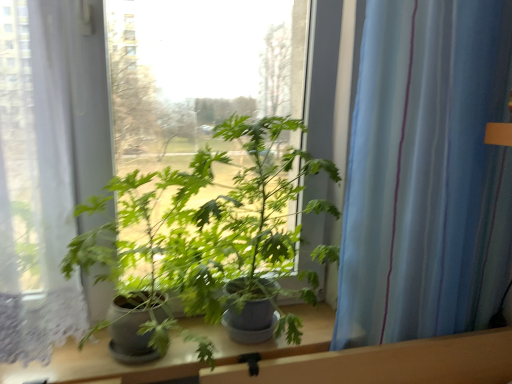
Where is `blue striped curtain at right`? This screenshot has width=512, height=384. blue striped curtain at right is located at coordinates (426, 173).

What is the approximate height of blue striped curtain at right?

It is 37.16 inches.

What do you see at coordinates (426, 173) in the screenshot?
I see `blue striped curtain at right` at bounding box center [426, 173].

The width and height of the screenshot is (512, 384). Describe the element at coordinates (264, 217) in the screenshot. I see `green matte plant at center` at that location.

Measure the distance between green matte plant at center and camera.

The distance of green matte plant at center from camera is 38.14 inches.

Locate an element on the screen. This screenshot has height=384, width=512. green matte plant at center is located at coordinates tap(264, 217).

This screenshot has width=512, height=384. In order to click on blue striped curtain at right in this screenshot , I will do [x=426, y=173].

Which is more to the left, green matte plant at center or blue striped curtain at right?

Positioned to the left is green matte plant at center.

Is green matte plant at center in front of blue striped curtain at right?

Yes, it is.

Is point (263, 137) in front of point (500, 269)?

That is True.

From the image's perspective, does green matte plant at center appear higher than blue striped curtain at right?

No, from the image's perspective, green matte plant at center is not over blue striped curtain at right.

Based on the photo, from a real-world perspective, is green matte plant at center below blue striped curtain at right?

Correct, in the physical world, green matte plant at center is lower than blue striped curtain at right.

Between green matte plant at center and blue striped curtain at right, which one has smaller width?

blue striped curtain at right is thinner.

Considering the sizes of green matte plant at center and blue striped curtain at right in the image, is green matte plant at center taller or shorter than blue striped curtain at right?

green matte plant at center is shorter than blue striped curtain at right.

Consider the image. Which of these two, green matte plant at center or blue striped curtain at right, is bigger?

Bigger between the two is green matte plant at center.

Is green matte plant at center not inside blue striped curtain at right?

Yes, green matte plant at center is outside of blue striped curtain at right.

Is green matte plant at center positioned far away from blue striped curtain at right?

No, green matte plant at center is not far from blue striped curtain at right.

Could you tell me if green matte plant at center is turned towards blue striped curtain at right?

No, green matte plant at center is not oriented towards blue striped curtain at right.

How distant is green matte plant at center from blue striped curtain at right?

green matte plant at center is 10.41 inches away from blue striped curtain at right.

This screenshot has height=384, width=512. In order to click on parsley located in front of the blue striped curtain at right in this screenshot , I will do `click(264, 217)`.

Considering the positions of objects blue striped curtain at right and green matte plant at center in the image provided, who is more to the right, blue striped curtain at right or green matte plant at center?

blue striped curtain at right.

Is blue striped curtain at right in front of green matte plant at center?

No, blue striped curtain at right is further to the viewer.

Which point is more forward, (420, 115) or (254, 209)?

Positioned in front is point (420, 115).

From the image's perspective, relative to green matte plant at center, is blue striped curtain at right above or below?

blue striped curtain at right is situated higher than green matte plant at center in the image.

From a real-world perspective, which object rests below the other?

From a 3D spatial view, green matte plant at center is below.

Does blue striped curtain at right have a greater width compared to green matte plant at center?

No, blue striped curtain at right is not wider than green matte plant at center.

Which of these two, blue striped curtain at right or green matte plant at center, stands shorter?

green matte plant at center.

Which of these two, blue striped curtain at right or green matte plant at center, is smaller?

blue striped curtain at right is smaller.

Can we say blue striped curtain at right lies outside green matte plant at center?

Yes, blue striped curtain at right is outside of green matte plant at center.

Looking at this image, is blue striped curtain at right directly adjacent to green matte plant at center?

No, blue striped curtain at right is not touching green matte plant at center.

Is blue striped curtain at right facing away from green matte plant at center?

No, blue striped curtain at right's orientation is not away from green matte plant at center.

Measure the distance from blue striped curtain at right to green matte plant at center.

blue striped curtain at right is 10.41 inches from green matte plant at center.

Where is `parsley below the blue striped curtain at right (from a real-world perspective)`? The width and height of the screenshot is (512, 384). parsley below the blue striped curtain at right (from a real-world perspective) is located at coordinates (264, 217).

Where is `curtain above the green matte plant at center (from the image's perspective)`? The width and height of the screenshot is (512, 384). curtain above the green matte plant at center (from the image's perspective) is located at coordinates (426, 173).

I want to click on parsley directly beneath the blue striped curtain at right (from a real-world perspective), so click(x=264, y=217).